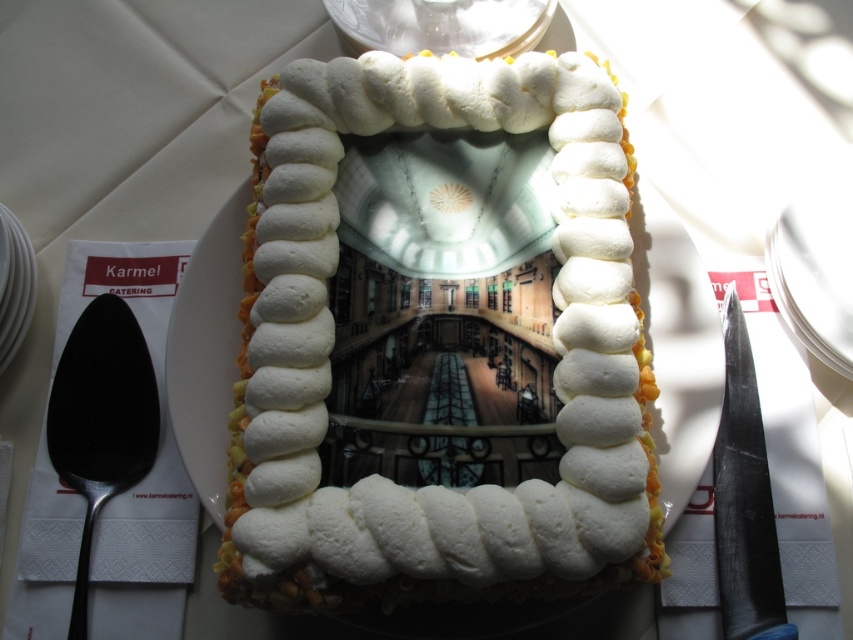
You are standing 30 inches away from the cake. Can you reach the point at coordinates point [393,563] on the cake?

The distance of point [393,563] from viewer is 26.78 inches, so yes, you can reach the point at coordinates point [393,563] on the cake since you are standing 30 inches away, which is farther than the point distance.

What are the coordinates of the white fluffy cake at center?

The white fluffy cake at center is located at coordinates point (334, 339).

You are at a birthday party and see a cake with a street scene on top. You have a polished silver spoon at left and a white paper plate at right. Which object is taller?

The polished silver spoon at left is much taller than the white paper plate at right.